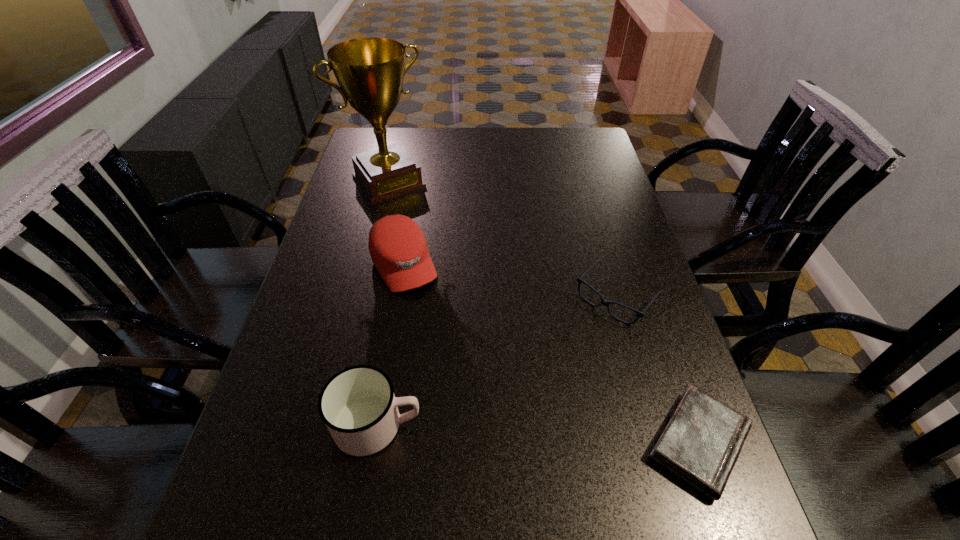
Where is `free space between the diary and the mug`? free space between the diary and the mug is located at coordinates (539, 434).

Find the location of a particular element. The width and height of the screenshot is (960, 540). empty location between the award and the shortest object is located at coordinates (543, 312).

The height and width of the screenshot is (540, 960). I want to click on unoccupied area between the spectacles and the cap, so click(x=510, y=280).

You are a GUI agent. You are given a task and a screenshot of the screen. Output one action in this format:
    pyautogui.click(x=<x>, y=<y>)
    Task: Click on the object that is the closest to the spectacles
    The image size is (960, 540).
    Given the screenshot: What is the action you would take?
    [x=701, y=443]

At what (x,y) coordinates should I click in order to perform the action: click on object that is the nearest to the mug. Please return your answer as a coordinate pair (x, y). Looking at the image, I should click on (398, 249).

At what (x,y) coordinates should I click in order to perform the action: click on vacant space that satisfies the following two spatial constraints: 1. on the front side of the farthest object; 2. on the left side of the cap. Please return your answer as a coordinate pair (x, y). The height and width of the screenshot is (540, 960). Looking at the image, I should click on (368, 265).

Find the location of `free space that satisfies the following two spatial constraints: 1. on the front side of the cap; 2. on the left side of the tallest object`. free space that satisfies the following two spatial constraints: 1. on the front side of the cap; 2. on the left side of the tallest object is located at coordinates (368, 265).